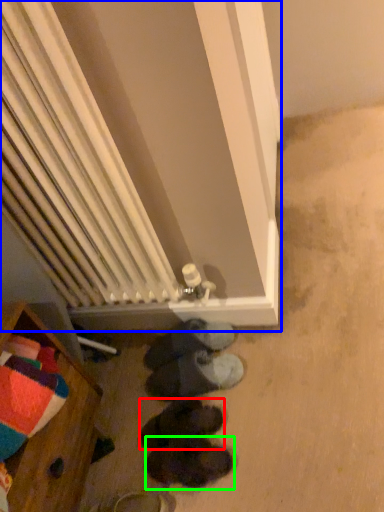
Question: Based on their relative distances, which object is farther from footwear (highlighted by a red box)? Choose from furnurniture (highlighted by a blue box) and footwear (highlighted by a green box).

Choices:
 (A) furnurniture
 (B) footwear

Answer: (A)